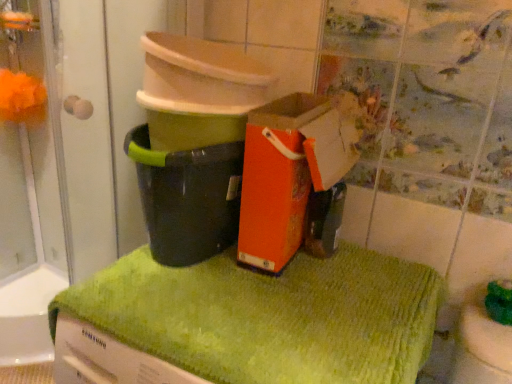
Question: From a real-world perspective, does orange fuzzy ball at upper left stand above black plastic bucket at center?

Choices:
 (A) yes
 (B) no

Answer: (A)

Question: Does orange fuzzy ball at upper left have a greater width compared to black plastic bucket at center?

Choices:
 (A) yes
 (B) no

Answer: (B)

Question: Is orange fuzzy ball at upper left thinner than black plastic bucket at center?

Choices:
 (A) yes
 (B) no

Answer: (A)

Question: Is orange fuzzy ball at upper left in front of black plastic bucket at center?

Choices:
 (A) no
 (B) yes

Answer: (A)

Question: Is orange fuzzy ball at upper left bigger than black plastic bucket at center?

Choices:
 (A) no
 (B) yes

Answer: (A)

Question: Does orange fuzzy ball at upper left have a smaller size compared to black plastic bucket at center?

Choices:
 (A) no
 (B) yes

Answer: (B)

Question: From a real-world perspective, is green textured bath towel at center beneath black plastic bucket at center?

Choices:
 (A) no
 (B) yes

Answer: (B)

Question: Is green textured bath towel at center not inside black plastic bucket at center?

Choices:
 (A) yes
 (B) no

Answer: (A)

Question: Is green textured bath towel at center oriented towards black plastic bucket at center?

Choices:
 (A) yes
 (B) no

Answer: (B)

Question: Is black plastic bucket at center a part of green textured bath towel at center?

Choices:
 (A) no
 (B) yes

Answer: (A)

Question: Does green textured bath towel at center appear on the right side of black plastic bucket at center?

Choices:
 (A) no
 (B) yes

Answer: (B)

Question: Is green textured bath towel at center in front of black plastic bucket at center?

Choices:
 (A) yes
 (B) no

Answer: (A)

Question: From the image's perspective, does orange paper bag at center appear higher than orange fuzzy ball at upper left?

Choices:
 (A) no
 (B) yes

Answer: (A)